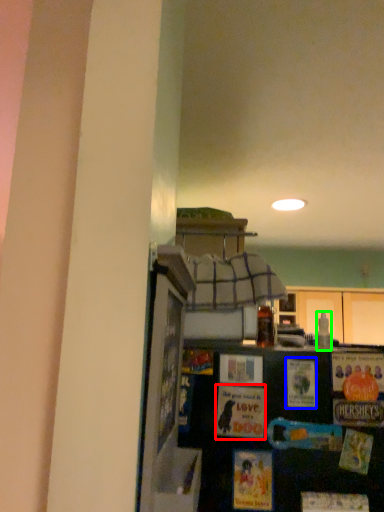
Question: Estimate the real-world distances between objects in this image. Which object is closer to postcard (highlighted by a red box), postcard (highlighted by a blue box) or bottle (highlighted by a green box)?

Choices:
 (A) postcard
 (B) bottle

Answer: (A)